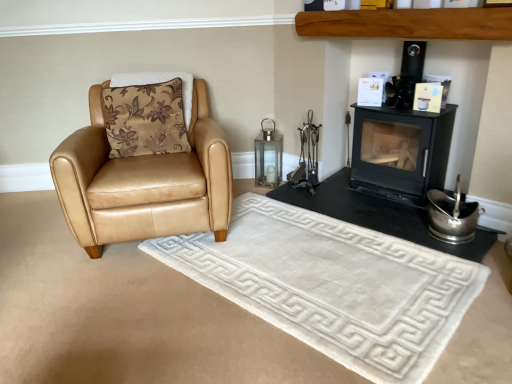
Question: Is black matte wood burning stove at upper right inside or outside of brown floral fabric pillow at left?

Choices:
 (A) outside
 (B) inside

Answer: (A)

Question: Looking at their shapes, would you say black matte wood burning stove at upper right is wider or thinner than brown floral fabric pillow at left?

Choices:
 (A) thin
 (B) wide

Answer: (A)

Question: Which object is positioned farthest from the black matte wood burning stove at upper right?

Choices:
 (A) tan leather armchair at left
 (B) black matte fireplace at right
 (C) white plush rug at center
 (D) brown floral fabric pillow at left

Answer: (D)

Question: Estimate the real-world distances between objects in this image. Which object is closer to the black matte wood burning stove at upper right?

Choices:
 (A) black matte fireplace at right
 (B) tan leather armchair at left
 (C) white plush rug at center
 (D) brown floral fabric pillow at left

Answer: (A)